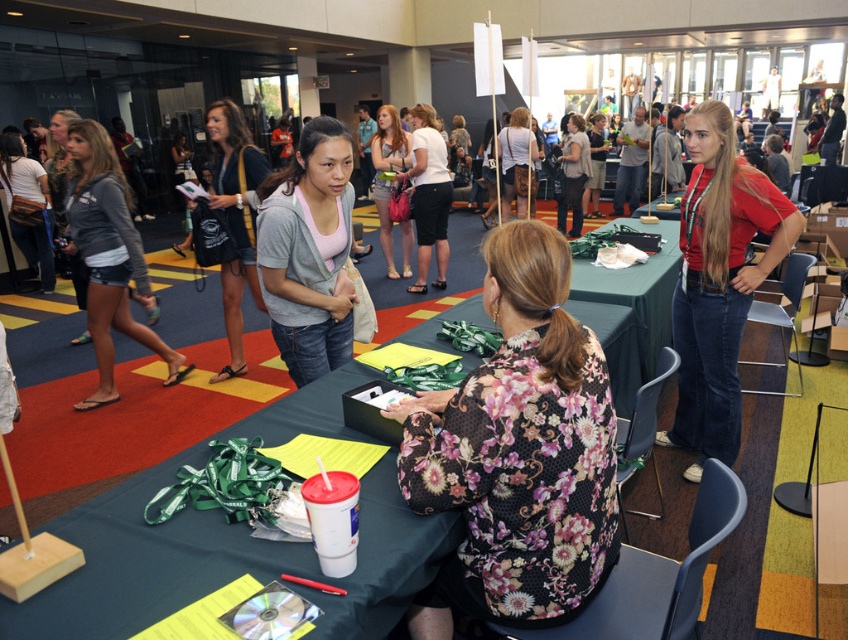
Question: Which of these objects is positioned farthest from the matte pink hoodie at center?

Choices:
 (A) matte gray shirt at center
 (B) floral-patterned blouse at center
 (C) matte gray hoodie at center
 (D) gray cotton shirt at center

Answer: (B)

Question: Is matte red shirt at center thinner than matte white shirt at center?

Choices:
 (A) no
 (B) yes

Answer: (B)

Question: Which point is closer to the camera?

Choices:
 (A) white cotton shirt at center
 (B) matte red shirt at center
 (C) matte pink hoodie at center
 (D) gray cotton shirt at center

Answer: (D)

Question: Which point appears closest to the camera in this image?

Choices:
 (A) (568, 236)
 (B) (388, 243)
 (C) (425, 179)

Answer: (C)

Question: From the image, what is the correct spatial relationship of matte red shirt at center in relation to matte gray hoodie at center?

Choices:
 (A) below
 (B) above

Answer: (A)

Question: Observing the image, what is the correct spatial positioning of gray cotton shirt at center in reference to matte gray hoodie at center?

Choices:
 (A) below
 (B) above

Answer: (A)